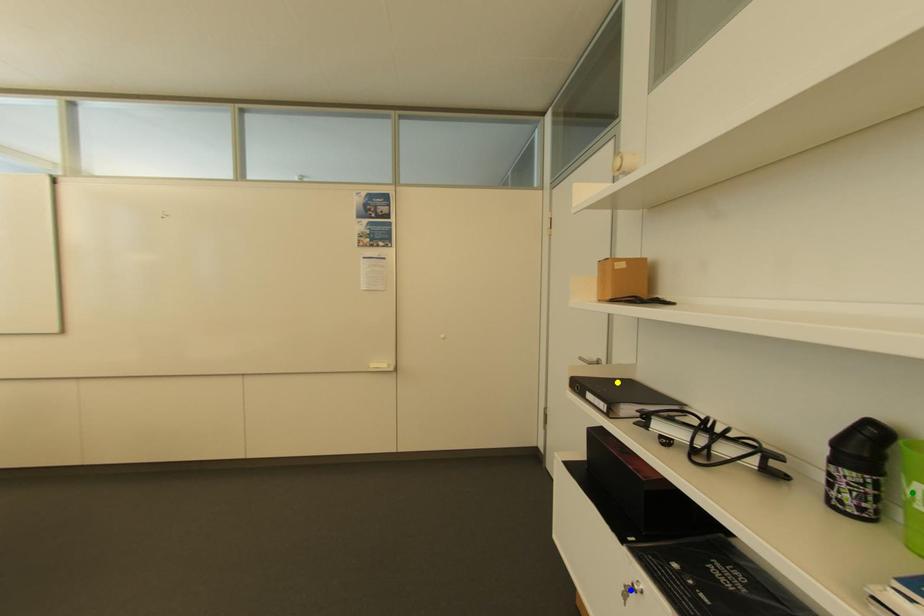
Order these from nearest to farthest:
blue point, yellow point, green point

1. green point
2. blue point
3. yellow point